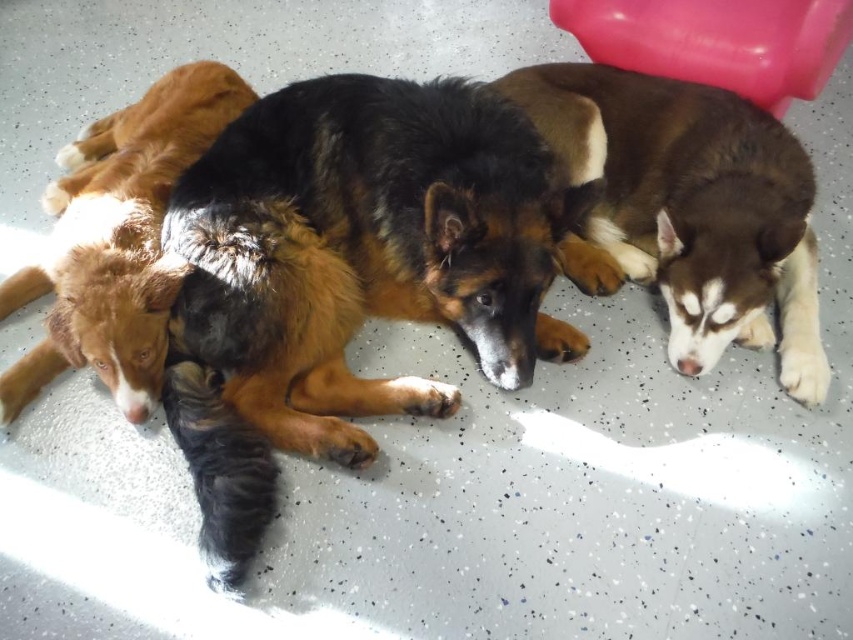
Question: Can you confirm if black fur dog at center is smaller than brown fur dog at right?

Choices:
 (A) no
 (B) yes

Answer: (A)

Question: Which object is the farthest from the brown fur dog at right?

Choices:
 (A) black fur dog at center
 (B) brown fluffy dog at center

Answer: (B)

Question: Which object is the farthest from the brown fluffy dog at center?

Choices:
 (A) black fur dog at center
 (B) brown fur dog at right

Answer: (B)

Question: Does brown fur dog at right appear on the right side of brown fluffy dog at center?

Choices:
 (A) no
 (B) yes

Answer: (B)

Question: Is black fur dog at center closer to camera compared to brown fluffy dog at center?

Choices:
 (A) no
 (B) yes

Answer: (B)

Question: Based on their relative distances, which object is farther from the brown fluffy dog at center?

Choices:
 (A) brown fur dog at right
 (B) black fur dog at center

Answer: (A)